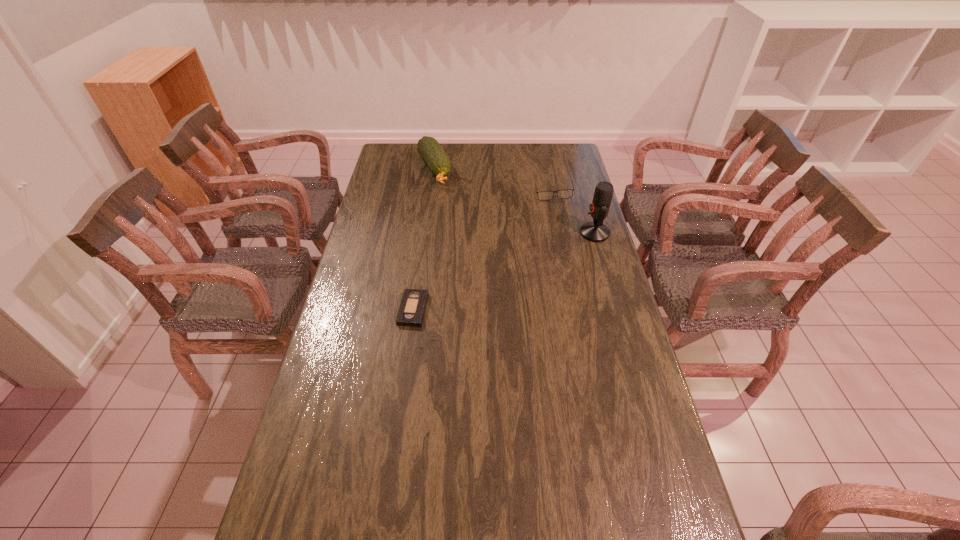
Locate an element on the screen. vacant spot on the desktop that is between the nearest object and the second nearest object and is positioned at the blossom end of the cucumber is located at coordinates (492, 276).

The image size is (960, 540). Find the location of `free space on the desktop that is between the nearest object and the tallest object and is positioned with the lenses facing outward on the spectacles`. free space on the desktop that is between the nearest object and the tallest object and is positioned with the lenses facing outward on the spectacles is located at coordinates (491, 276).